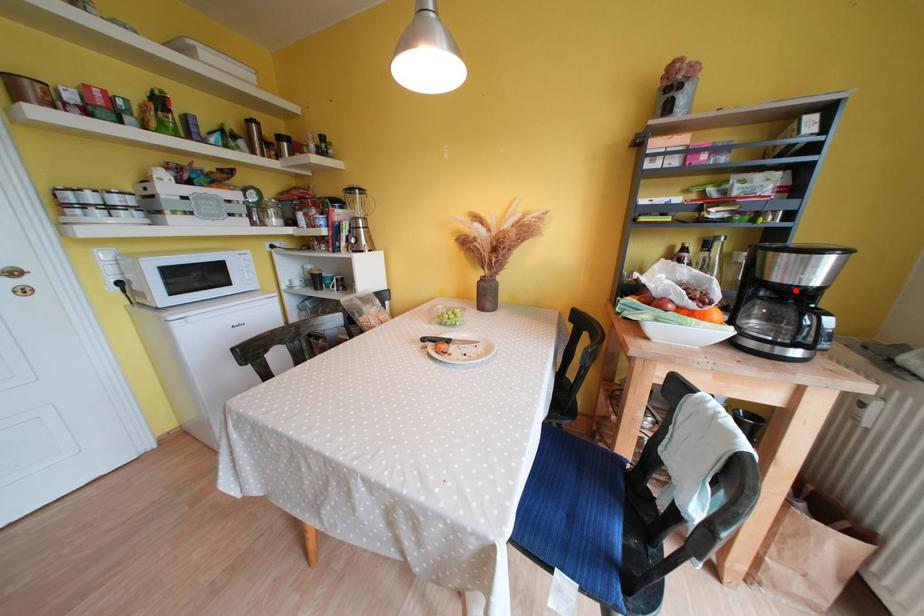
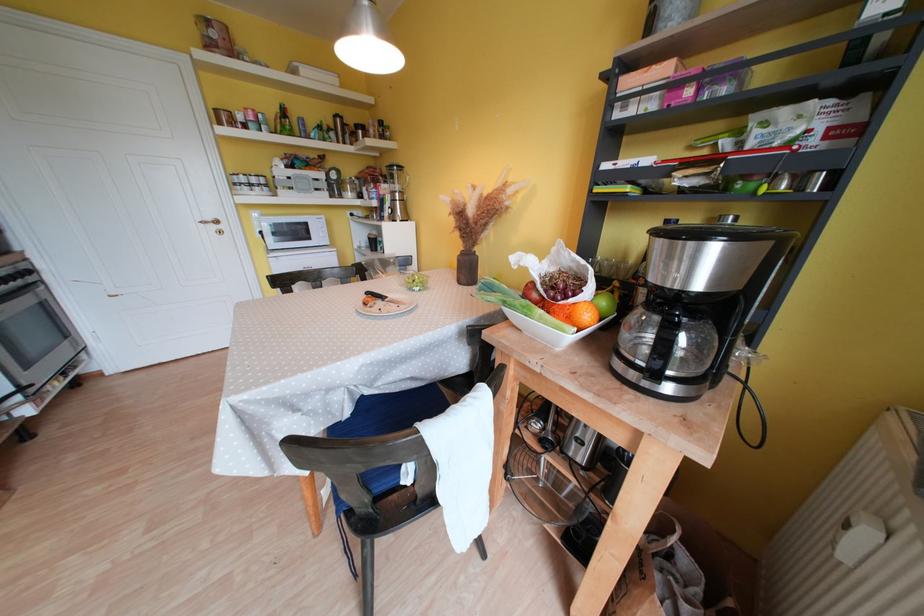
The point at the highlighted location is marked in the first image. Where is the corresponding point in the second image?

(669, 292)